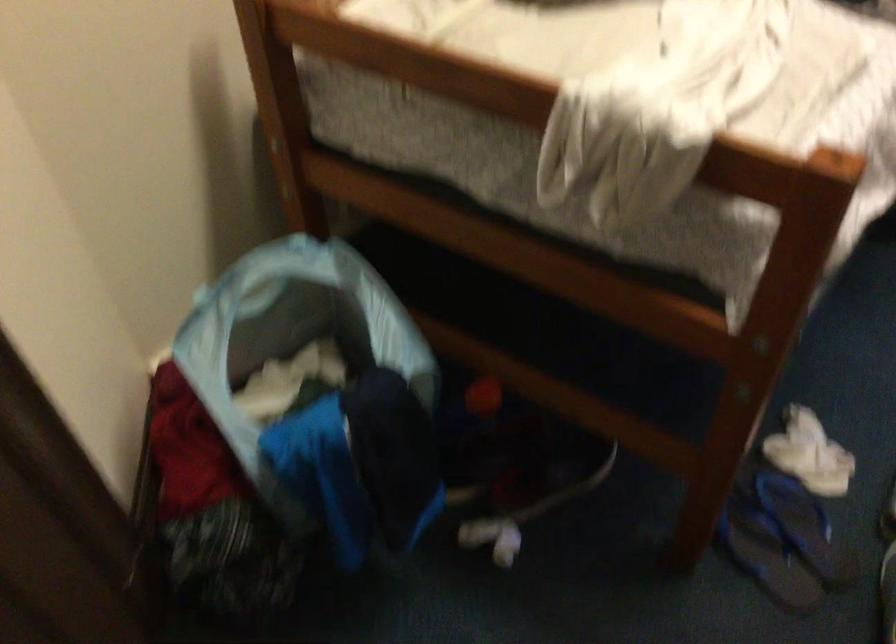
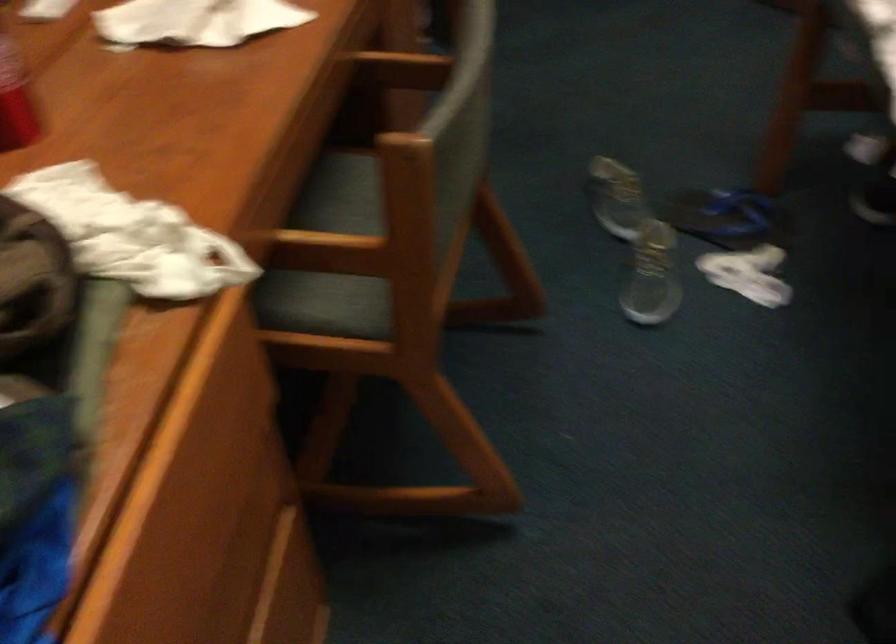
Where in the second image is the point corresponding to (780,513) from the first image?

(728, 218)